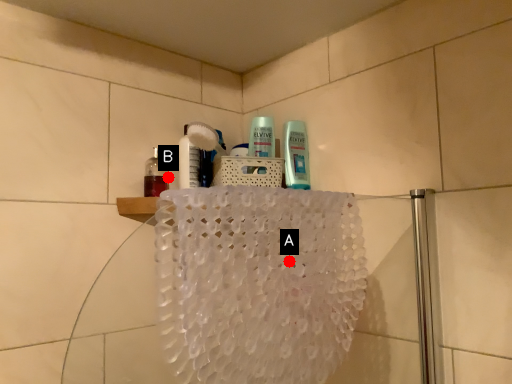
Question: Two points are circled on the image, labeled by A and B beside each circle. Among these points, which one is nearest to the camera?

Choices:
 (A) A is closer
 (B) B is closer

Answer: (A)